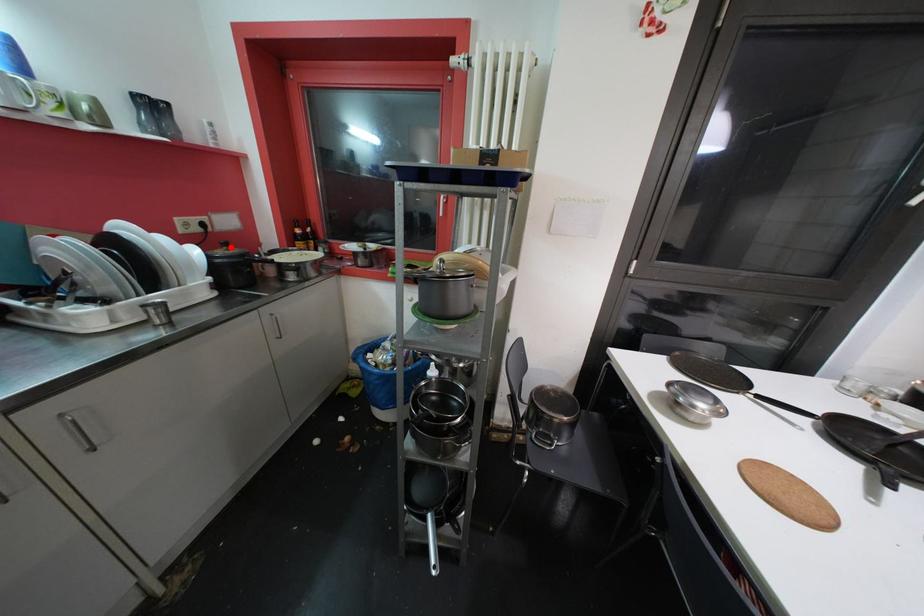
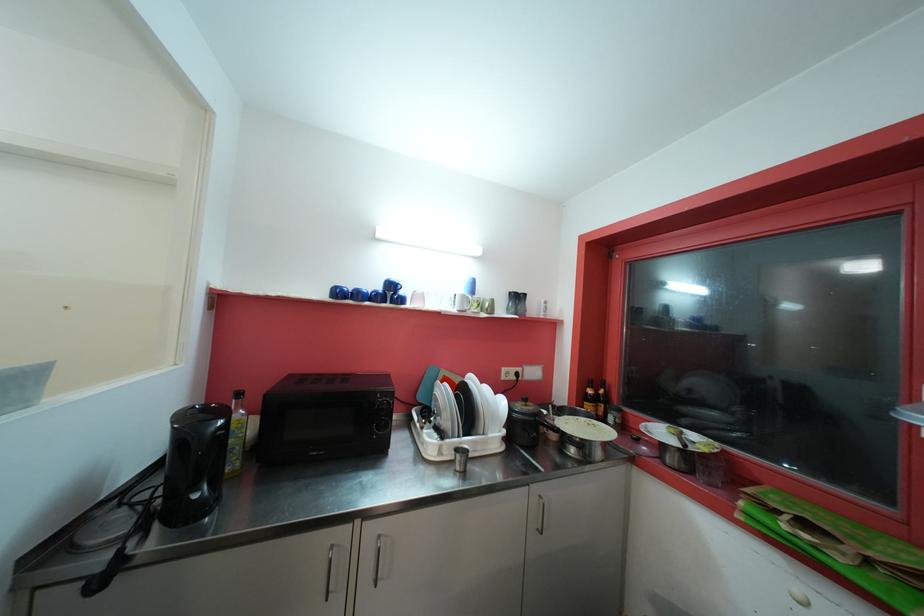
The point at the highlighted location is marked in the first image. Where is the corresponding point in the second image?

(530, 403)